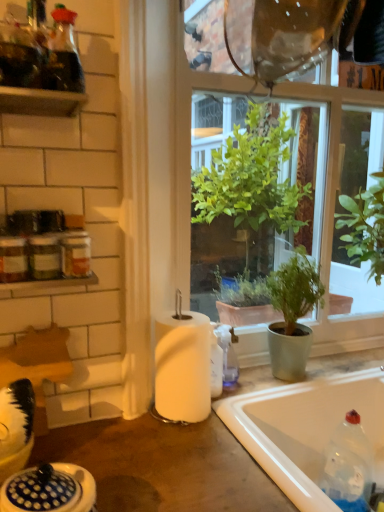
The image size is (384, 512). Identify the location of free space to the left of white matte paper towel at center. (119, 426).